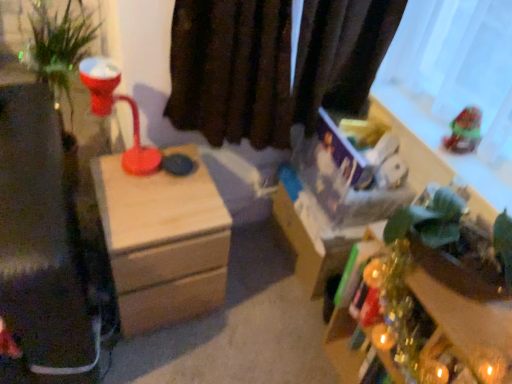
Where is `empty space that is ontop of wooden nightstand at center (from a real-world perspective)`? This screenshot has height=384, width=512. empty space that is ontop of wooden nightstand at center (from a real-world perspective) is located at coordinates (151, 188).